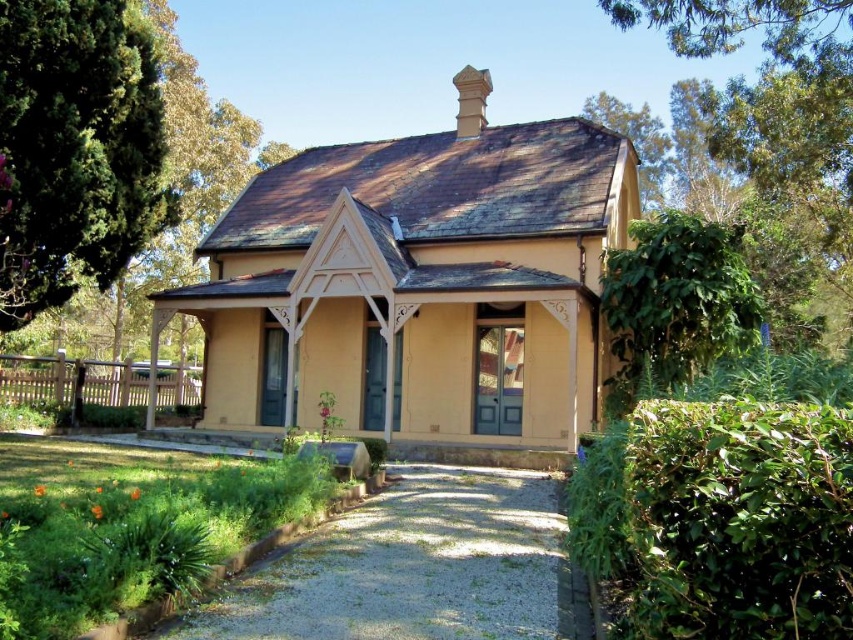
Question: Which point is closer to the camera?

Choices:
 (A) green leafy tree at left
 (B) matte yellow house at center
 (C) gray gravel driveway at center

Answer: (C)

Question: Is green leafy tree at left further to the viewer compared to green leafy bush at upper right?

Choices:
 (A) yes
 (B) no

Answer: (B)

Question: Is gray gravel driveway at center thinner than green leafy tree at left?

Choices:
 (A) yes
 (B) no

Answer: (B)

Question: Estimate the real-world distances between objects in this image. Which object is closer to the white wooden porch at lower left?

Choices:
 (A) matte yellow house at center
 (B) green leafy bush at upper right
 (C) green leafy tree at left

Answer: (C)

Question: Among these points, which one is nearest to the camera?

Choices:
 (A) (61, 262)
 (B) (549, 540)

Answer: (B)

Question: Is green leafy tree at left closer to the viewer compared to green leafy bush at upper right?

Choices:
 (A) no
 (B) yes

Answer: (B)